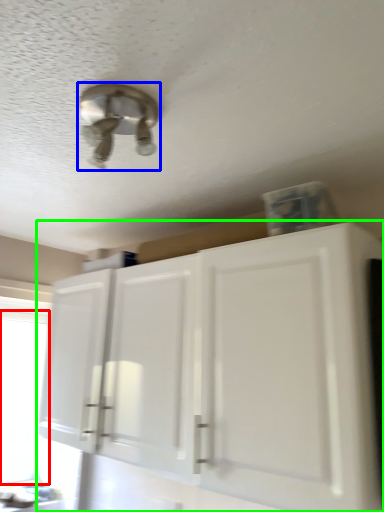
Question: Which object is the closest to the window screen (highlighted by a red box)? Choose among these: light fixture (highlighted by a blue box) or cabinetry (highlighted by a green box).

Choices:
 (A) light fixture
 (B) cabinetry

Answer: (B)